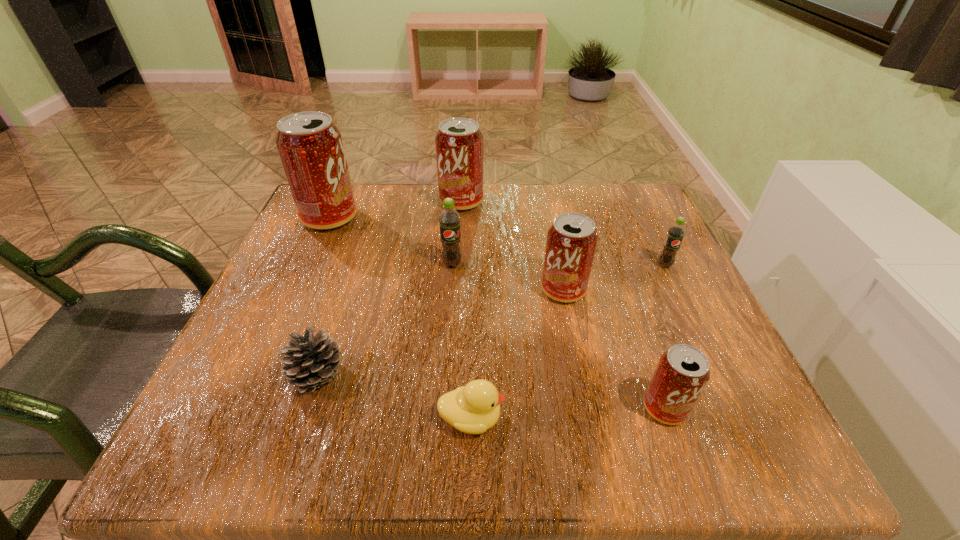
Locate an element on the screen. vacant space located on the front of the second shortest object is located at coordinates (295, 450).

Locate an element on the screen. vacant space located 0.270m on the beak of the yellow duckling is located at coordinates (687, 418).

Find the location of a particular element. soda can that is at the near edge is located at coordinates (682, 372).

Where is `duckling that is at the near edge`? The image size is (960, 540). duckling that is at the near edge is located at coordinates (473, 409).

The height and width of the screenshot is (540, 960). Identify the location of soda can present at the left edge. (310, 146).

At what (x,y) coordinates should I click in order to perform the action: click on pinecone situated at the left edge. Please return your answer as a coordinate pair (x, y). Image resolution: width=960 pixels, height=540 pixels. Looking at the image, I should click on (313, 361).

At what (x,y) coordinates should I click in order to perform the action: click on object that is at the far left corner. Please return your answer as a coordinate pair (x, y). The width and height of the screenshot is (960, 540). Looking at the image, I should click on (310, 146).

At what (x,y) coordinates should I click in order to perform the action: click on object that is positioned at the near right corner. Please return your answer as a coordinate pair (x, y). The width and height of the screenshot is (960, 540). Looking at the image, I should click on (682, 372).

The image size is (960, 540). I want to click on free region at the far edge, so click(429, 195).

Where is `blank space at the near edge`? blank space at the near edge is located at coordinates (411, 430).